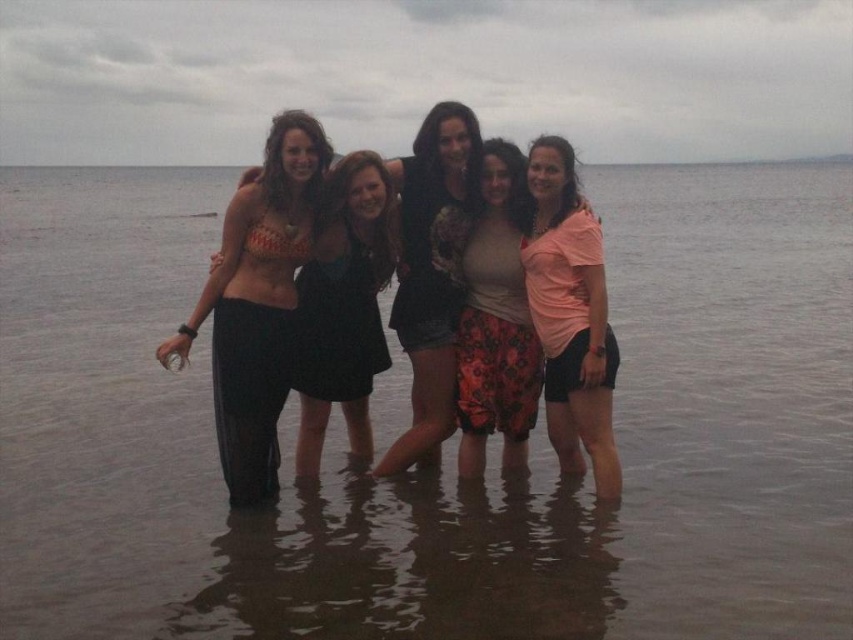
Who is more distant from viewer, (265, 492) or (469, 385)?

The point (469, 385) is behind.

Find the location of `matte black bikini top at left`. matte black bikini top at left is located at coordinates (257, 301).

Is matte bikini top at center thinner than floral cotton shorts at center?

Incorrect, matte bikini top at center's width is not less than floral cotton shorts at center's.

Who is higher up, matte bikini top at center or floral cotton shorts at center?

floral cotton shorts at center is above.

Image resolution: width=853 pixels, height=640 pixels. Identify the location of matte bikini top at center. (344, 307).

Find the location of a particular element. matte bikini top at center is located at coordinates [x=344, y=307].

Is the position of matte black bikini top at left more distant than that of pink cotton shirt at center?

Yes.

Does matte black bikini top at left have a greater height compared to pink cotton shirt at center?

Yes, matte black bikini top at left is taller than pink cotton shirt at center.

The height and width of the screenshot is (640, 853). I want to click on matte black bikini top at left, so 257,301.